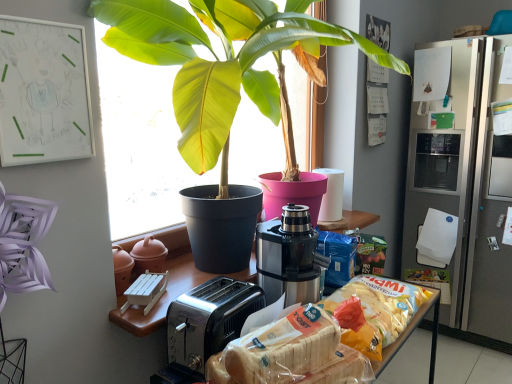
Question: Choose the correct answer: Is translucent plastic bag of chips at center, which is the first snack in back-to-front order, inside stainless steel coffee machine at center or outside it?

Choices:
 (A) inside
 (B) outside

Answer: (B)

Question: From a real-world perspective, is translucent plastic bag of chips at center, which is the first snack in back-to-front order, above or below stainless steel coffee machine at center?

Choices:
 (A) above
 (B) below

Answer: (B)

Question: Considering the real-world distances, which object is closest to the translucent plastic bag of chips at center, which is the first snack in back-to-front order?

Choices:
 (A) white plastic bread at lower center, arranged as the first snack when viewed from the front
 (B) green glossy leafy plant at center
 (C) satin silver refrigerator at right
 (D) stainless steel coffee machine at center

Answer: (D)

Question: Which object is positioned closest to the white plastic bread at lower center, arranged as the first snack when viewed from the front?

Choices:
 (A) satin silver refrigerator at right
 (B) stainless steel coffee machine at center
 (C) translucent plastic bag of chips at center, which is the first snack in back-to-front order
 (D) green glossy leafy plant at center

Answer: (C)